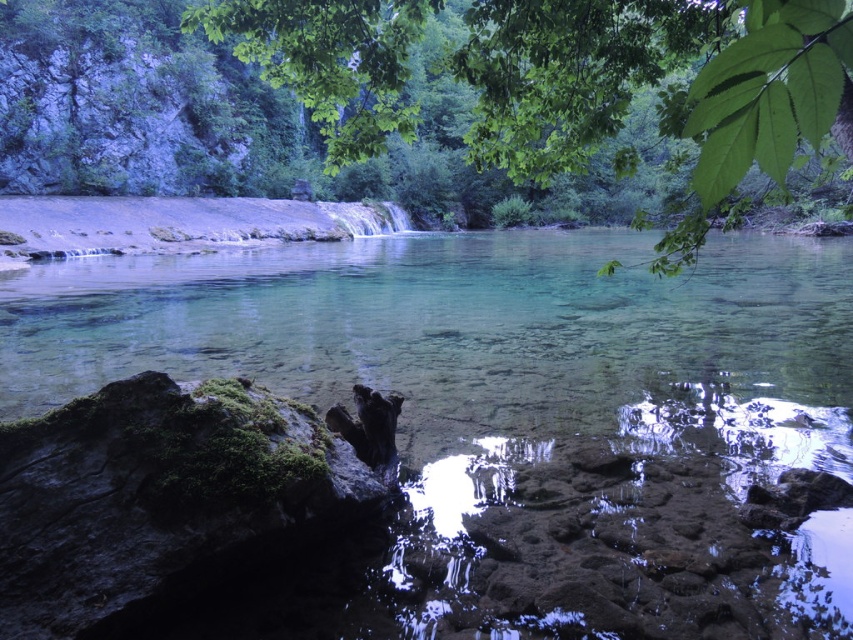
You are an artist planning to paint the scene. You want to ensure that the green leafy tree at upper center and the clear glassy water at center are both visible. Which object should you paint first if you follow the rule of painting larger objects before smaller ones?

The green leafy tree at upper center should be painted first because it occupies more space than the clear glassy water at center, according to the rule of painting larger objects first.

You are standing at the point with coordinates point (619, 88) and want to look at point (556, 353). Can you see it without moving your position?

Point (556, 353) is behind point (619, 88), so you cannot see it from your current position without moving.